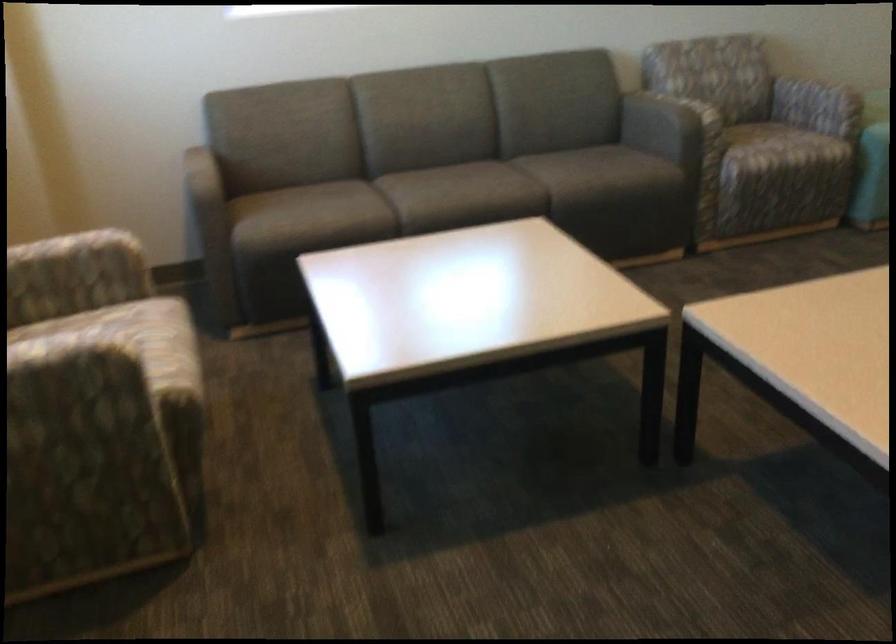
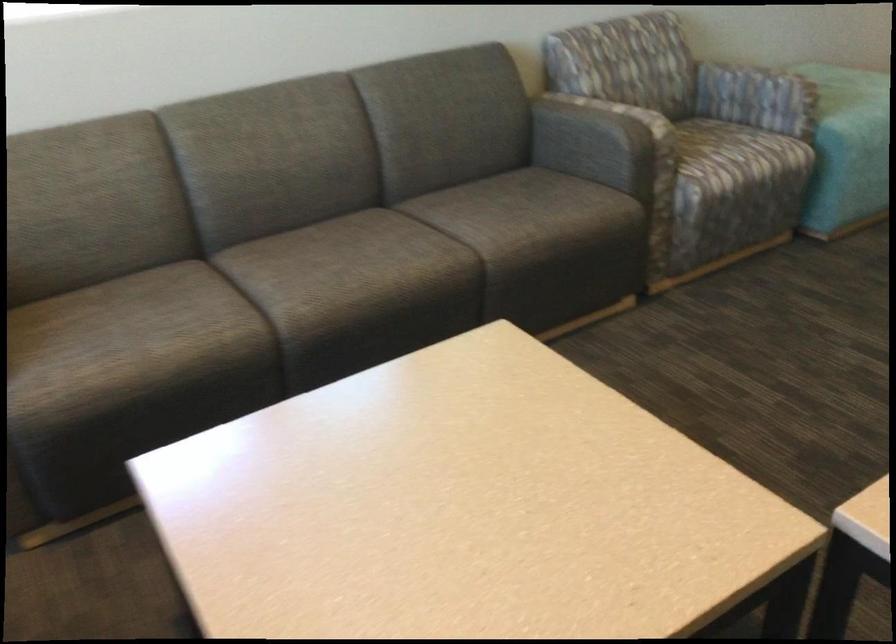
Locate, in the second image, the point that corresponds to the point at 505,194 in the first image.

(427, 269)